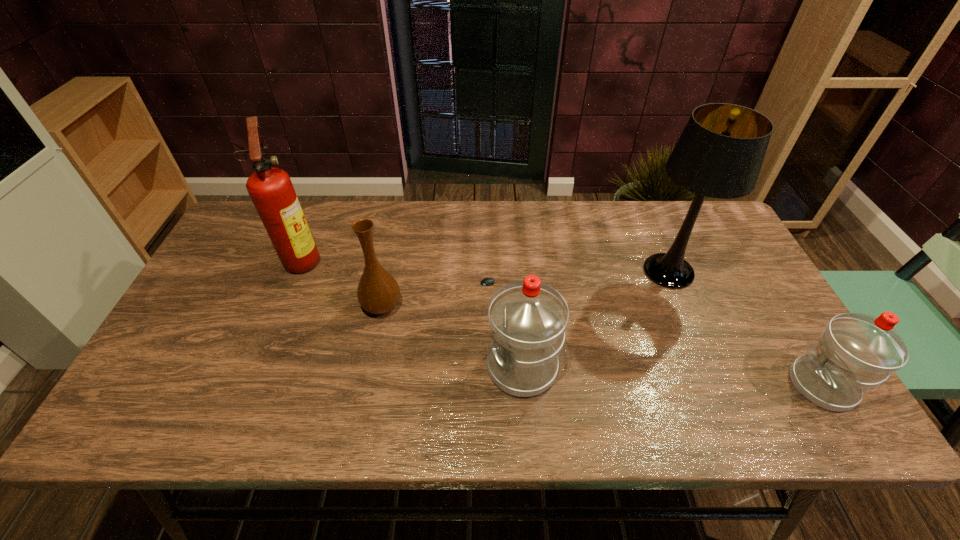
I want to click on free space between the right water bottle and the left water bottle, so [672, 376].

In order to click on vacant region between the leftmost object and the taller water bottle in this screenshot , I will do `click(412, 313)`.

Where is `vacant area that lies between the shorter water bottle and the second object from right to left`? vacant area that lies between the shorter water bottle and the second object from right to left is located at coordinates (745, 328).

This screenshot has height=540, width=960. In order to click on free spot between the second object from left to right and the mouse in this screenshot , I will do `click(440, 294)`.

Locate an element on the screen. The height and width of the screenshot is (540, 960). blank region between the shortest object and the vase is located at coordinates (440, 294).

Locate an element on the screen. free space between the vase and the left water bottle is located at coordinates (452, 336).

The image size is (960, 540). What are the coordinates of `empty space that is in between the leftmost object and the table lamp` in the screenshot? It's located at (486, 265).

Locate an element on the screen. the closest object to the fire extinguisher is located at coordinates (378, 292).

Where is `the fifth closest object relative to the fire extinguisher`? the fifth closest object relative to the fire extinguisher is located at coordinates (856, 352).

At what (x,y) coordinates should I click in order to perform the action: click on vacant space that satisfies the following two spatial constraints: 1. on the back side of the fifth object from left to right; 2. on the front-facing side of the leftmost object. Please return your answer as a coordinate pair (x, y). Looking at the image, I should click on (663, 259).